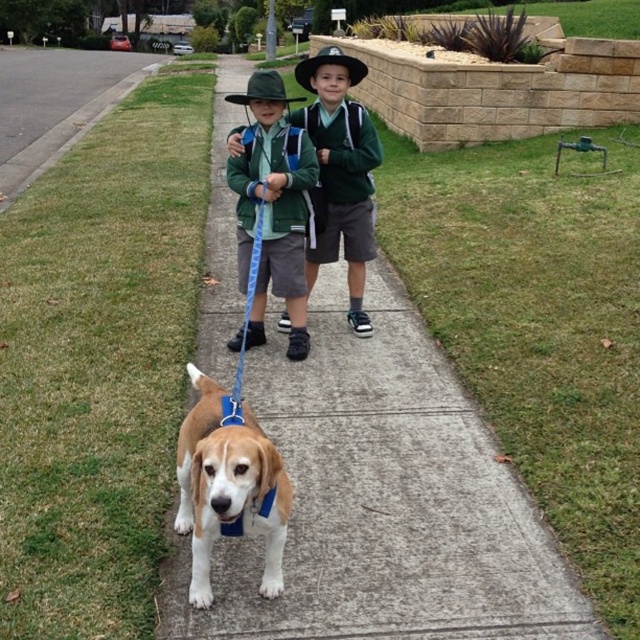
From the picture: Between concrete at center and green grass at lower left, which one is positioned higher?

green grass at lower left is higher up.

Is concrete at center bigger than green grass at lower left?

Incorrect, concrete at center is not larger than green grass at lower left.

Identify the location of concrete at center. (384, 499).

Does brown matte dog at center appear on the left side of green grass at lower left?

No, brown matte dog at center is not to the left of green grass at lower left.

Is brown matte dog at center smaller than green grass at lower left?

Indeed, brown matte dog at center has a smaller size compared to green grass at lower left.

Does point (268, 564) come in front of point (49, 131)?

Yes, it is in front of point (49, 131).

You are a GUI agent. You are given a task and a screenshot of the screen. Output one action in this format:
    pyautogui.click(x=<x>, y=<y>)
    Task: Click on the brown matte dog at center
    
    Given the screenshot: What is the action you would take?
    pyautogui.click(x=228, y=486)

Is concrete at center shorter than brown matte dog at center?

No, concrete at center is not shorter than brown matte dog at center.

Does concrete at center appear under brown matte dog at center?

Actually, concrete at center is above brown matte dog at center.

At what (x,y) coordinates should I click in order to perform the action: click on concrete at center. Please return your answer as a coordinate pair (x, y). The width and height of the screenshot is (640, 640). Looking at the image, I should click on (384, 499).